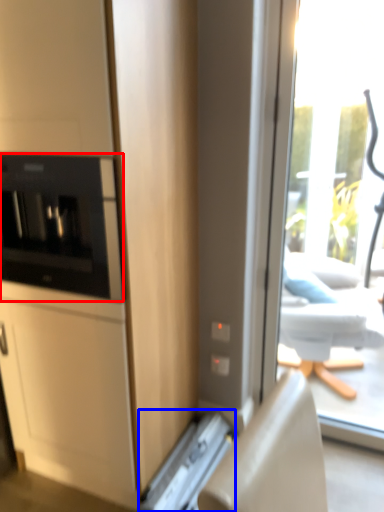
Question: Which point is closer to the camera, home appliance (highlighted by a red box) or appliance (highlighted by a blue box)?

Choices:
 (A) home appliance
 (B) appliance

Answer: (A)